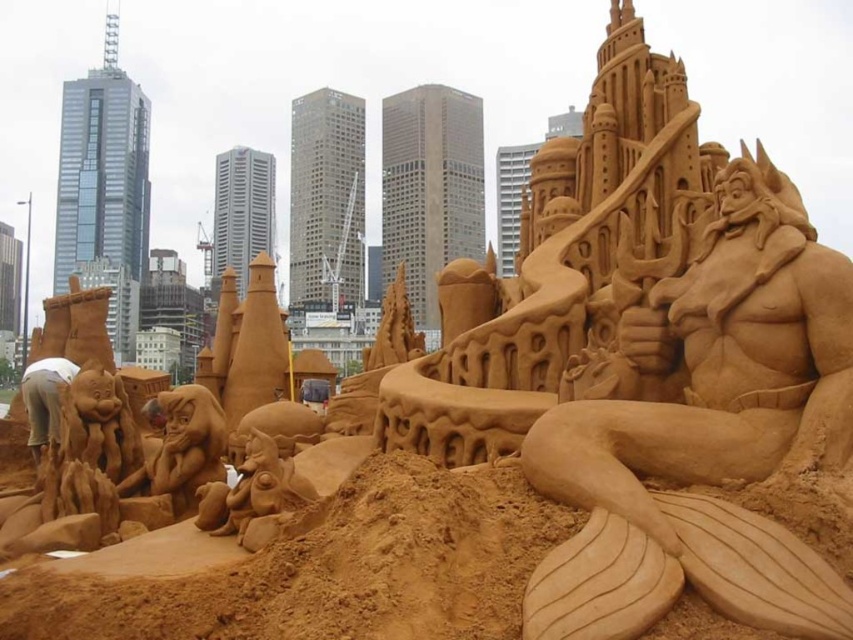
You are a photographer standing in front of the sand sculptures. You want to take a photo that includes both the brown sand sculpture at lower center and the brown sand sculpture at lower left. Which sculpture should you position closer to the left side of your camera frame?

The brown sand sculpture at lower left should be positioned closer to the left side of your camera frame because it is located to the left of the brown sand sculpture at lower center.

You are a city planner evaluating the sand sculpture for a public space. You need to ensure that the brown sand merman at center and the brown sand sculpture at lower left are visible from the main walkway. Based on their positions, which one is more likely to block the view of the other?

The brown sand merman at center is positioned over the brown sand sculpture at lower left, so it may block the view of the brown sand sculpture at lower left from the main walkway.

You are a photographer standing in front of the sand sculpture. You want to take a photo that includes both the brown sand merman at center and the brown sand sculpture at lower center. Which object should be positioned closer to the camera to ensure both are in focus?

The brown sand merman at center is in front of brown sand sculpture at lower center, so positioning the camera closer to the brown sand merman at center will keep both in focus as the merman is already in front.